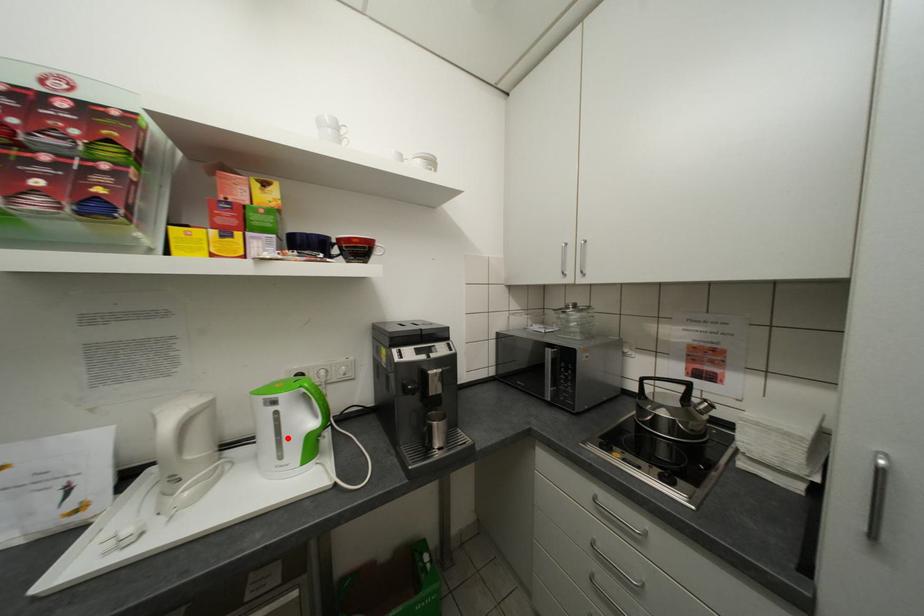
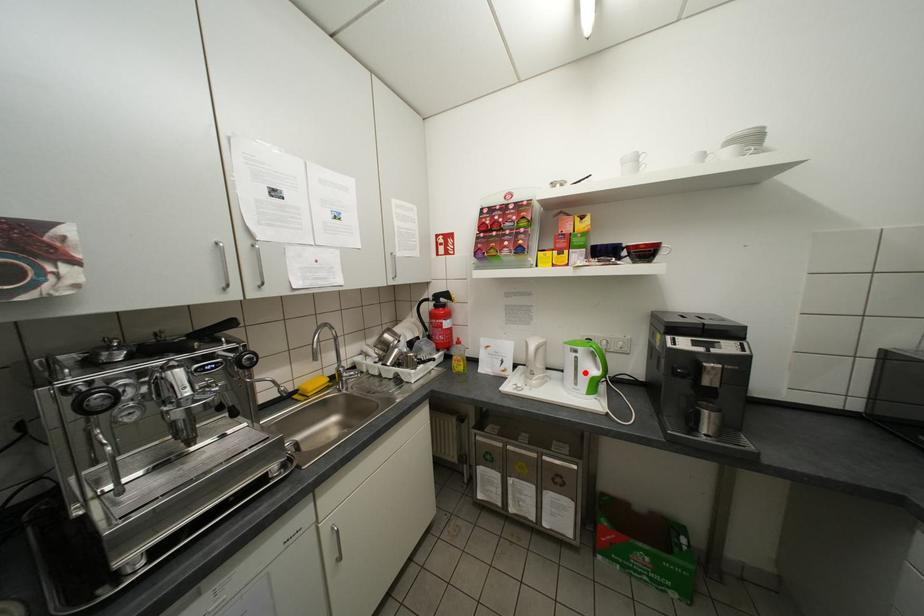
I am providing you with two images of the same scene from different viewpoints. A red point is marked on the first image and another point is marked on the second image. Is the marked point in image1 the same physical position as the marked point in image2?

Yes